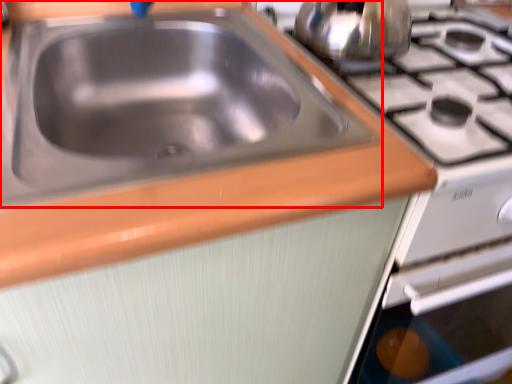
Question: From the image's perspective, where is sink (annotated by the red box) located in relation to tea pot in the image?

Choices:
 (A) below
 (B) above

Answer: (A)